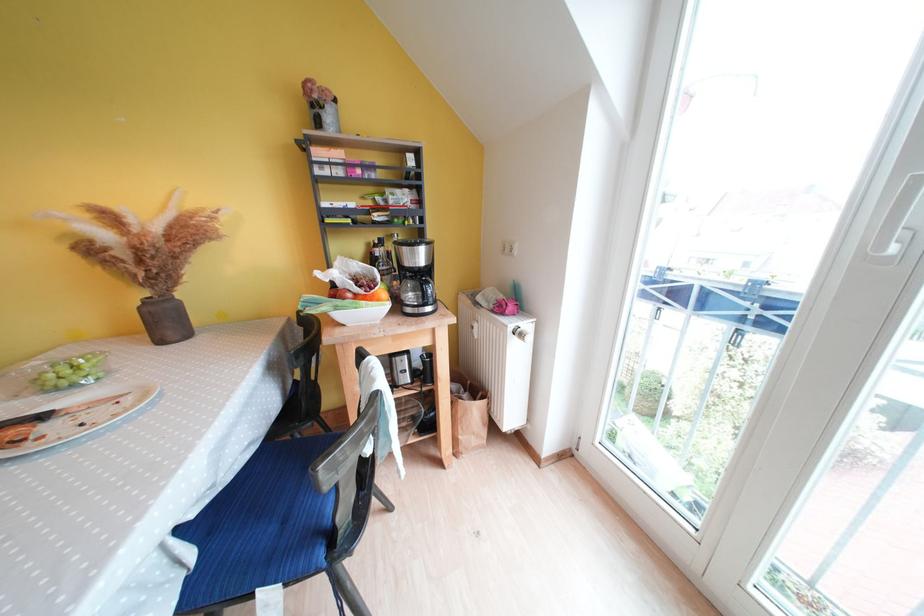
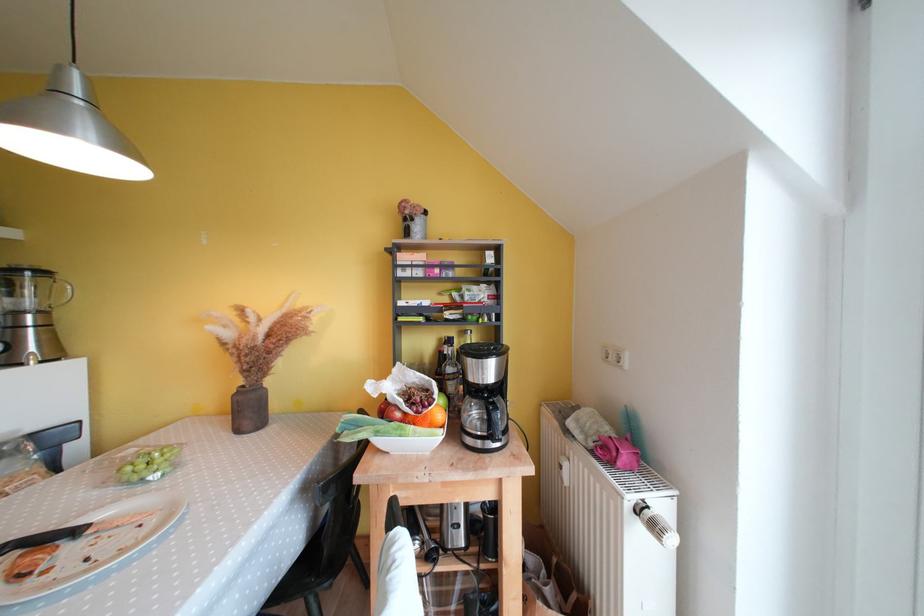
Locate, in the second image, the point that corresponds to (49,419) in the first image.

(83, 535)